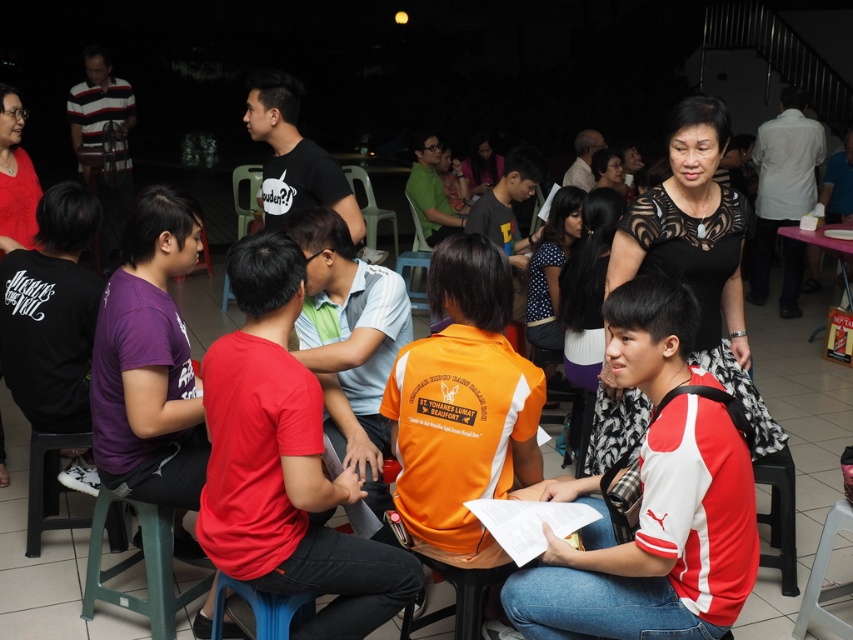
Does green plastic chair at lower left have a smaller size compared to blue plastic chair at lower center?

No, green plastic chair at lower left is not smaller than blue plastic chair at lower center.

What do you see at coordinates (144, 566) in the screenshot? I see `green plastic chair at lower left` at bounding box center [144, 566].

Where is `green plastic chair at lower left`? green plastic chair at lower left is located at coordinates (144, 566).

Is red matte shirt at center to the right of white plastic chair at center from the viewer's perspective?

Correct, you'll find red matte shirt at center to the right of white plastic chair at center.

The image size is (853, 640). What do you see at coordinates (283, 461) in the screenshot? I see `red matte shirt at center` at bounding box center [283, 461].

Image resolution: width=853 pixels, height=640 pixels. I want to click on red matte shirt at center, so click(x=283, y=461).

Measure the distance from plastic stool at lower right to white plastic chair at center.

plastic stool at lower right is 4.67 meters away from white plastic chair at center.

Which is more to the right, plastic stool at lower right or white plastic chair at center?

Positioned to the right is plastic stool at lower right.

Is point (833, 621) positioned after point (396, 248)?

No, it is in front of (396, 248).

At what (x,y) coordinates should I click in order to perform the action: click on plastic stool at lower right. Please return your answer as a coordinate pair (x, y). Looking at the image, I should click on (822, 577).